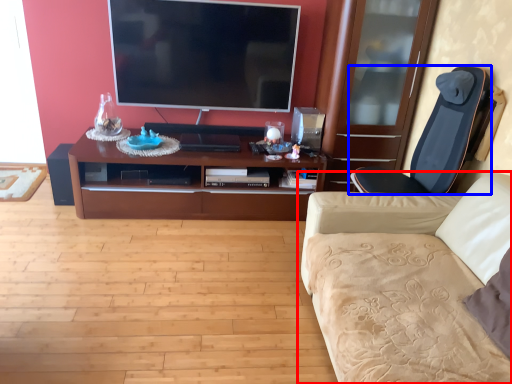
Question: Which object is closer to the camera taking this photo, studio couch (highlighted by a red box) or chair (highlighted by a blue box)?

Choices:
 (A) studio couch
 (B) chair

Answer: (A)